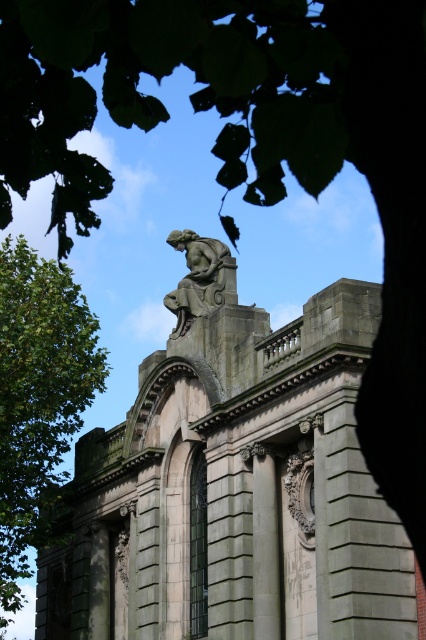
Question: Which point is farther to the camera?

Choices:
 (A) (350, 496)
 (B) (224, 300)

Answer: (B)

Question: Does gray stone statue at upper center appear over bronze statue at upper center?

Choices:
 (A) no
 (B) yes

Answer: (A)

Question: Is green leafy tree at left closer to camera compared to bronze statue at upper center?

Choices:
 (A) no
 (B) yes

Answer: (A)

Question: Estimate the real-world distances between objects in this image. Which object is closer to the gray stone statue at upper center?

Choices:
 (A) green leafy tree at left
 (B) bronze statue at upper center

Answer: (A)

Question: Which point appears closest to the camera in this image?

Choices:
 (A) (36, 392)
 (B) (112, 602)
 (C) (224, 284)

Answer: (C)

Question: From the image, what is the correct spatial relationship of green leafy tree at left in relation to bronze statue at upper center?

Choices:
 (A) below
 (B) above

Answer: (A)